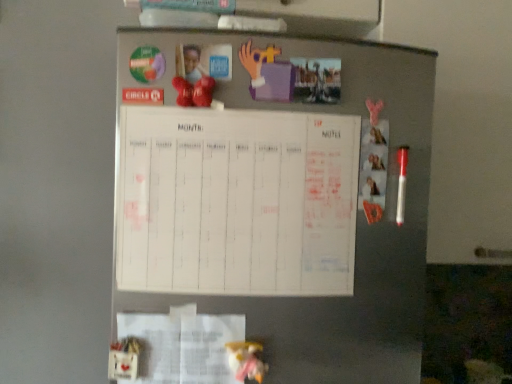
Question: Is white fabric doll at lower center to the right of white paper at lower left from the viewer's perspective?

Choices:
 (A) no
 (B) yes

Answer: (B)

Question: Would you consider white fabric doll at lower center to be distant from white paper at lower left?

Choices:
 (A) no
 (B) yes

Answer: (A)

Question: From the image's perspective, is white fabric doll at lower center above white paper at lower left?

Choices:
 (A) no
 (B) yes

Answer: (B)

Question: Is white fabric doll at lower center taller than white paper at lower left?

Choices:
 (A) yes
 (B) no

Answer: (B)

Question: From a real-world perspective, is white fabric doll at lower center under white paper at lower left?

Choices:
 (A) yes
 (B) no

Answer: (B)

Question: Is point (234, 362) positioned closer to the camera than point (215, 243)?

Choices:
 (A) closer
 (B) farther

Answer: (B)

Question: Looking at the image, does white fabric doll at lower center seem bigger or smaller compared to white paperboard at center?

Choices:
 (A) big
 (B) small

Answer: (B)

Question: Relative to white paperboard at center, is white fabric doll at lower center in front or behind?

Choices:
 (A) front
 (B) behind

Answer: (A)

Question: Would you say white fabric doll at lower center is inside or outside white paperboard at center?

Choices:
 (A) inside
 (B) outside

Answer: (B)

Question: Does point (176, 337) appear closer or farther from the camera than point (361, 195)?

Choices:
 (A) farther
 (B) closer

Answer: (B)

Question: In terms of width, does white paper at lower left look wider or thinner when compared to pink paper at right?

Choices:
 (A) thin
 (B) wide

Answer: (A)

Question: Would you say white paper at lower left is to the left or to the right of pink paper at right in the picture?

Choices:
 (A) right
 (B) left

Answer: (B)

Question: From a real-world perspective, is white paper at lower left physically located above or below pink paper at right?

Choices:
 (A) above
 (B) below

Answer: (B)

Question: Does point (377, 155) appear closer or farther from the camera than point (228, 350)?

Choices:
 (A) closer
 (B) farther

Answer: (B)

Question: Considering the positions of pink paper at right and white fabric doll at lower center in the image, is pink paper at right taller or shorter than white fabric doll at lower center?

Choices:
 (A) tall
 (B) short

Answer: (A)